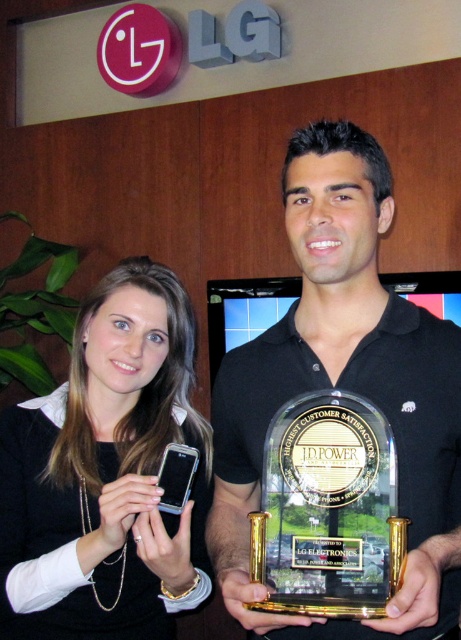
You are attending an LG Electronics event and notice two trophies displayed in the center of the room. The black glossy trophy at center and the clear acrylic trophy at center. Which trophy is positioned higher up?

The black glossy trophy at center is located above the clear acrylic trophy at center, so it is positioned higher up.

You are organizing a tech exhibition and need to place the black glossy trophy at center and the matte black phone at center on a display stand. The stand has limited space. Based on the scene description, which object should you prioritize placing first to ensure both fit?

The black glossy trophy at center occupies less space than the matte black phone at center, so you should prioritize placing the matte black phone at center first to ensure both fit on the display stand.